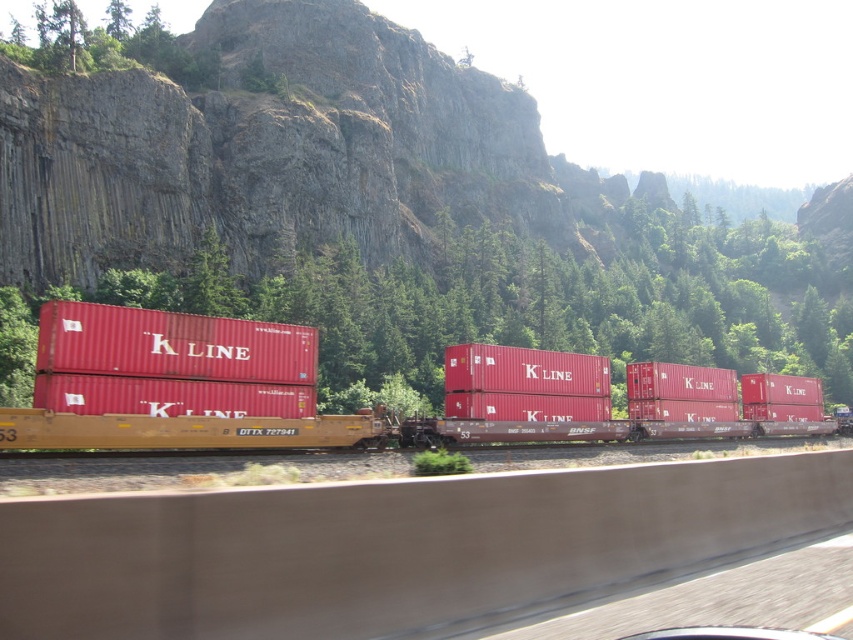
Does matte red shipping container at center appear under matte red container at center?

Correct, matte red shipping container at center is located below matte red container at center.

Is point (180, 438) positioned after point (309, 362)?

No.

Identify the location of matte red shipping container at center. (283, 394).